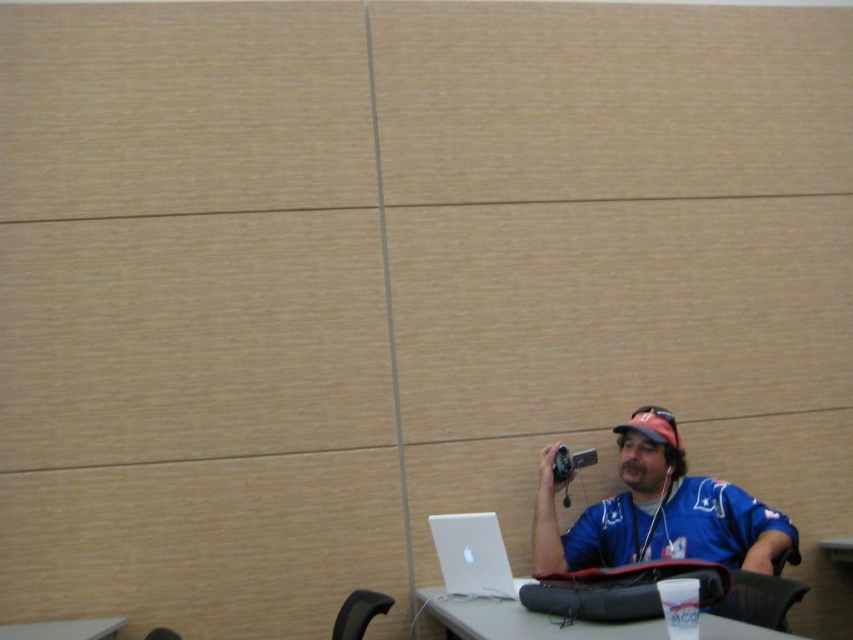
Who is taller, blue jersey at lower right or white plastic table at lower center?

blue jersey at lower right is taller.

In the scene shown: Is blue jersey at lower right positioned behind white plastic table at lower center?

Yes, it is.

The height and width of the screenshot is (640, 853). Describe the element at coordinates (659, 509) in the screenshot. I see `blue jersey at lower right` at that location.

In order to click on blue jersey at lower right in this screenshot , I will do pos(659,509).

You are a GUI agent. You are given a task and a screenshot of the screen. Output one action in this format:
    pyautogui.click(x=<x>, y=<y>)
    Task: Click on the silver metallic laptop at lower center
    The height and width of the screenshot is (640, 853).
    Given the screenshot: What is the action you would take?
    pyautogui.click(x=473, y=556)

Find the location of a particular element. The height and width of the screenshot is (640, 853). silver metallic laptop at lower center is located at coordinates (473, 556).

Is silver metallic laptop at lower center positioned in front of silver metallic video camera at upper right?

Yes, silver metallic laptop at lower center is closer to the viewer.

Looking at this image, can you confirm if silver metallic laptop at lower center is positioned below silver metallic video camera at upper right?

Yes.

At what (x,y) coordinates should I click in order to perform the action: click on silver metallic laptop at lower center. Please return your answer as a coordinate pair (x, y). Looking at the image, I should click on (473, 556).